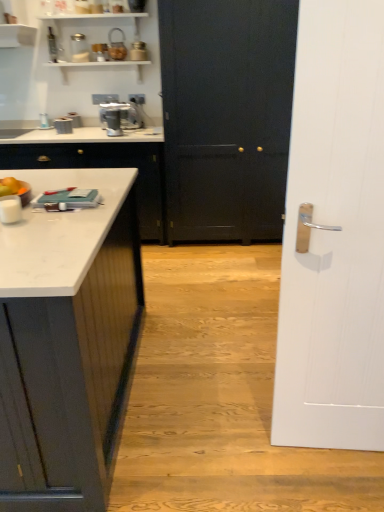
Question: Can you confirm if metallic silver coffee maker at upper center is positioned to the left of white wood door at right, which appears as the 1th door when viewed from the front?

Choices:
 (A) no
 (B) yes

Answer: (B)

Question: Is metallic silver coffee maker at upper center turned away from white wood door at right, acting as the 2th door starting from the back?

Choices:
 (A) no
 (B) yes

Answer: (A)

Question: Considering the relative sizes of metallic silver coffee maker at upper center and white wood door at right, acting as the 2th door starting from the back, in the image provided, is metallic silver coffee maker at upper center smaller than white wood door at right, acting as the 2th door starting from the back,?

Choices:
 (A) no
 (B) yes

Answer: (B)

Question: Can you confirm if metallic silver coffee maker at upper center is wider than white wood door at right, acting as the 2th door starting from the back?

Choices:
 (A) no
 (B) yes

Answer: (B)

Question: Are metallic silver coffee maker at upper center and white wood door at right, which appears as the 1th door when viewed from the front, far apart?

Choices:
 (A) no
 (B) yes

Answer: (B)

Question: Is metallic silver coffee maker at upper center at the right side of white wood door at right, acting as the 2th door starting from the back?

Choices:
 (A) yes
 (B) no

Answer: (B)

Question: Considering the relative sizes of metallic silver coffee maker at upper center and orange matte fruit at left in the image provided, is metallic silver coffee maker at upper center wider than orange matte fruit at left?

Choices:
 (A) no
 (B) yes

Answer: (B)

Question: From a real-world perspective, is metallic silver coffee maker at upper center located higher than orange matte fruit at left?

Choices:
 (A) no
 (B) yes

Answer: (B)

Question: Is metallic silver coffee maker at upper center not inside orange matte fruit at left?

Choices:
 (A) no
 (B) yes

Answer: (B)

Question: Considering the relative positions of metallic silver coffee maker at upper center and orange matte fruit at left in the image provided, is metallic silver coffee maker at upper center to the right of orange matte fruit at left from the viewer's perspective?

Choices:
 (A) no
 (B) yes

Answer: (B)

Question: Is metallic silver coffee maker at upper center thinner than orange matte fruit at left?

Choices:
 (A) yes
 (B) no

Answer: (B)

Question: Does metallic silver coffee maker at upper center have a lesser height compared to orange matte fruit at left?

Choices:
 (A) no
 (B) yes

Answer: (A)

Question: Considering the relative sizes of white wood door at right, which appears as the 1th door when viewed from the front, and black matte door at center, which ranks as the first door in back-to-front order, in the image provided, is white wood door at right, which appears as the 1th door when viewed from the front, smaller than black matte door at center, which ranks as the first door in back-to-front order,?

Choices:
 (A) no
 (B) yes

Answer: (B)